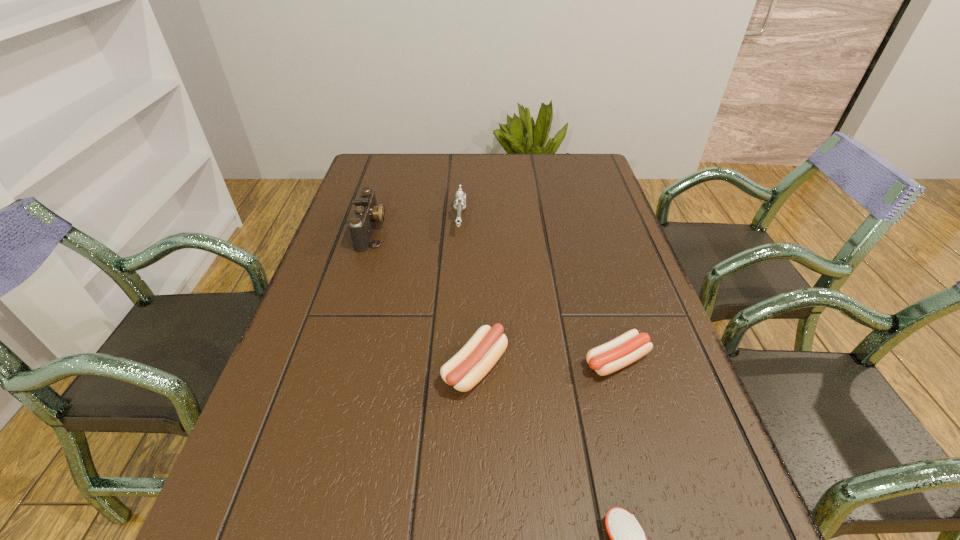
Identify the location of camera. This screenshot has height=540, width=960. (366, 213).

Where is `gun`? The width and height of the screenshot is (960, 540). gun is located at coordinates (460, 202).

What are the coordinates of `the left sausage` in the screenshot? It's located at (470, 365).

Find the location of a particular element. The image size is (960, 540). the taller sausage is located at coordinates (470, 365).

At what (x,y) coordinates should I click in order to perform the action: click on the right sausage. Please return your answer as a coordinate pair (x, y). This screenshot has height=540, width=960. Looking at the image, I should click on (620, 352).

Where is `the shorter sausage`? Image resolution: width=960 pixels, height=540 pixels. the shorter sausage is located at coordinates (620, 352).

Locate an element on the screen. The image size is (960, 540). free space located on the front-facing side of the leftmost object is located at coordinates (411, 231).

You are a GUI agent. You are given a task and a screenshot of the screen. Output one action in this format:
    pyautogui.click(x=<x>, y=<y>)
    Task: Click on the free space located aimed along the barrel of the gun
    
    Given the screenshot: What is the action you would take?
    pyautogui.click(x=458, y=263)

I want to click on vacant space located 0.290m on the back of the third shortest object, so click(x=476, y=254).

In order to click on vacant space located on the left of the right sausage in this screenshot , I will do `click(431, 361)`.